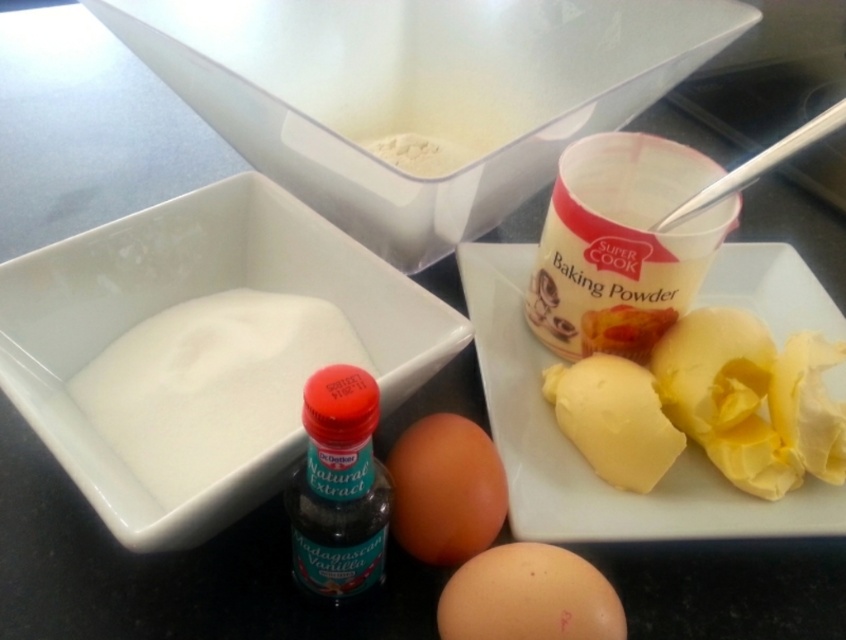
Can you confirm if yellow creamy butter at right is positioned to the right of brown matte egg at lower center?

Correct, you'll find yellow creamy butter at right to the right of brown matte egg at lower center.

Between point (790, 422) and point (438, 618), which one is positioned in front?

Positioned in front is point (438, 618).

Where is `yellow creamy butter at right`? yellow creamy butter at right is located at coordinates (707, 404).

Which is more to the left, yellow creamy butter at right or white powder at left?

Positioned to the left is white powder at left.

Describe the element at coordinates (707, 404) in the screenshot. The image size is (846, 640). I see `yellow creamy butter at right` at that location.

Is point (647, 401) positioned in front of point (152, 486)?

No, (647, 401) is behind (152, 486).

The height and width of the screenshot is (640, 846). I want to click on yellow creamy butter at right, so click(x=707, y=404).

Which of these two, brown matte egg at lower center or orange matte egg at center, stands taller?

orange matte egg at center is taller.

Is brown matte egg at lower center smaller than orange matte egg at center?

Yes.

What do you see at coordinates (528, 596) in the screenshot?
I see `brown matte egg at lower center` at bounding box center [528, 596].

Find the location of `brown matte egg at lower center`. brown matte egg at lower center is located at coordinates (528, 596).